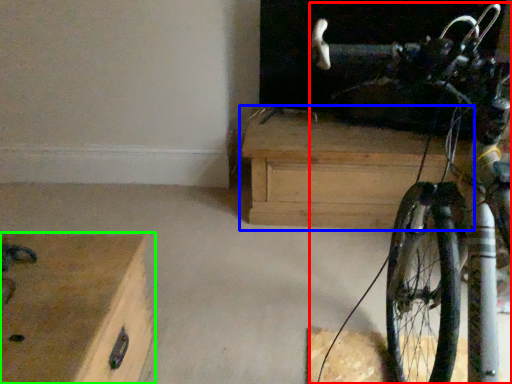
Question: Estimate the real-world distances between objects in this image. Which object is farther from bicycle (highlighted by a red box), chest of drawers (highlighted by a blue box) or chest of drawers (highlighted by a green box)?

Choices:
 (A) chest of drawers
 (B) chest of drawers

Answer: (B)